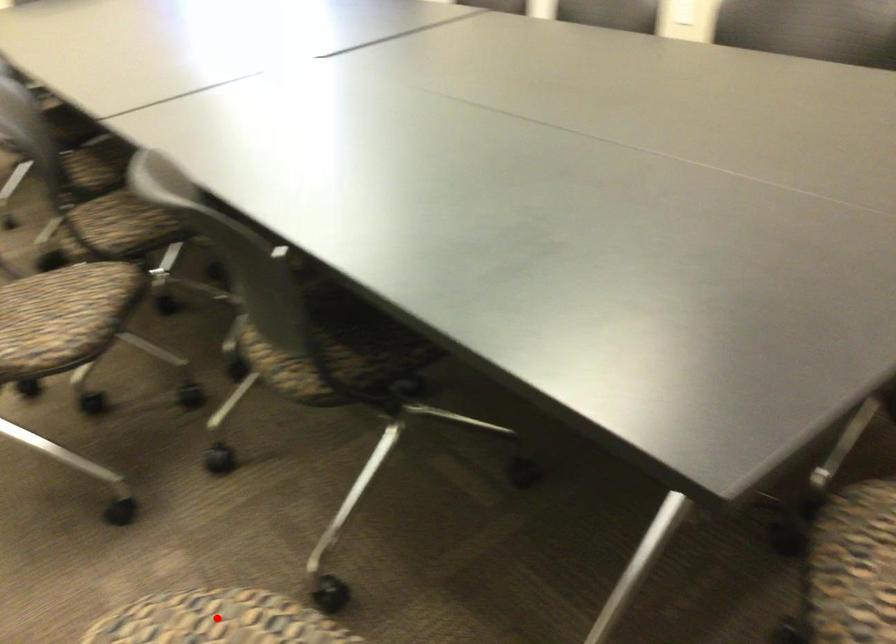
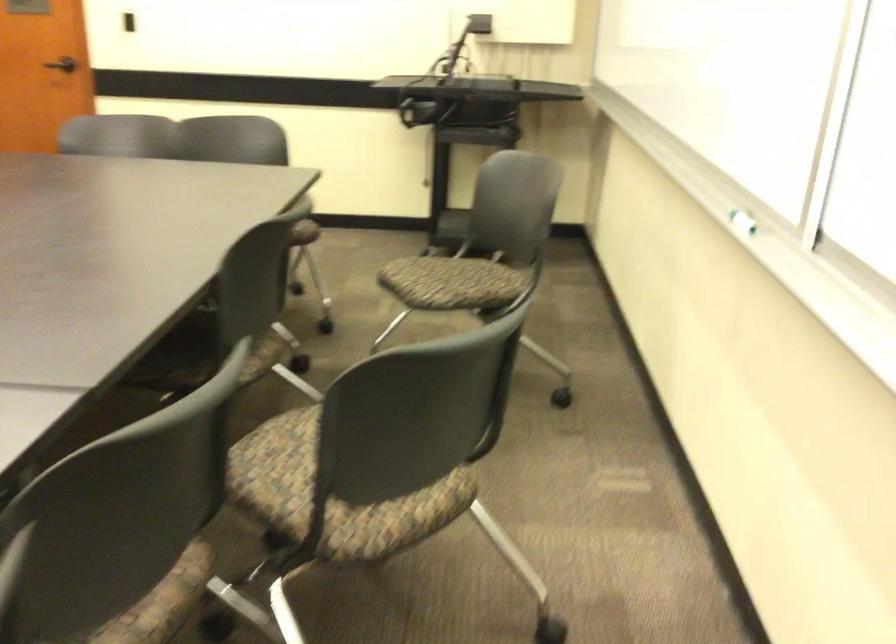
Question: I am providing you with two images of the same scene from different viewpoints. A red point is marked on the first image. Can you still see the location of the red point in image 2?

Choices:
 (A) Yes
 (B) No

Answer: (B)